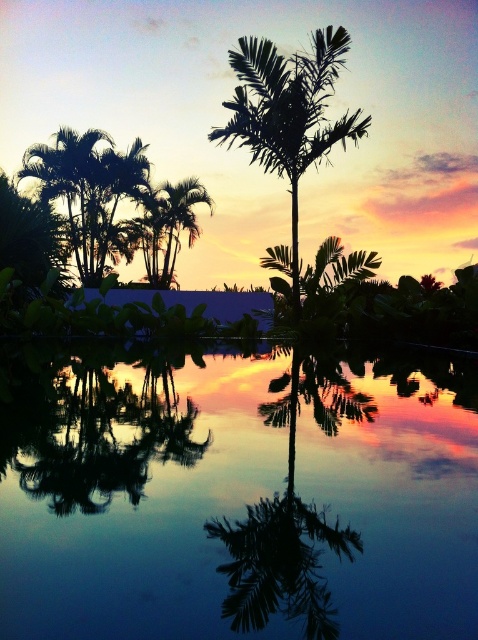
Question: Observing the image, what is the correct spatial positioning of transparent glass pond at center in reference to green leafy palm tree at center?

Choices:
 (A) below
 (B) above

Answer: (A)

Question: Does transparent glass pond at center appear under silhouette leafy palm at center?

Choices:
 (A) no
 (B) yes

Answer: (B)

Question: Among these points, which one is nearest to the camera?

Choices:
 (A) (191, 200)
 (B) (32, 419)
 (C) (325, 97)
 (D) (175, 550)

Answer: (D)

Question: Based on their relative distances, which object is farther from the transparent glass pond at center?

Choices:
 (A) green leafy palm tree at center
 (B) silhouette leafy palm at center

Answer: (A)

Question: Which object appears farthest from the camera in this image?

Choices:
 (A) green leafy palm tree at center
 (B) black glossy palm tree at center
 (C) silhouette leafy palm at center

Answer: (A)

Question: Does transparent glass pond at center appear under silhouette leafy palm at center?

Choices:
 (A) no
 (B) yes

Answer: (B)